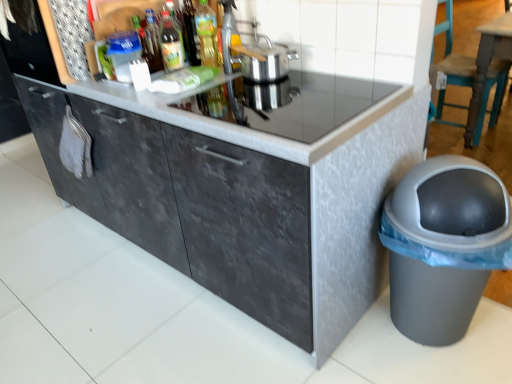
Question: Considering the relative sizes of metallic silver pot at upper center and translucent glass bottle at upper center, the first bottle in the right-to-left sequence, in the image provided, is metallic silver pot at upper center thinner than translucent glass bottle at upper center, the first bottle in the right-to-left sequence,?

Choices:
 (A) yes
 (B) no

Answer: (A)

Question: Does metallic silver pot at upper center have a smaller size compared to translucent glass bottle at upper center, the 4th bottle viewed from the left?

Choices:
 (A) no
 (B) yes

Answer: (A)

Question: Considering the relative sizes of metallic silver pot at upper center and translucent glass bottle at upper center, the first bottle in the right-to-left sequence, in the image provided, is metallic silver pot at upper center shorter than translucent glass bottle at upper center, the first bottle in the right-to-left sequence,?

Choices:
 (A) no
 (B) yes

Answer: (B)

Question: From the image's perspective, is metallic silver pot at upper center beneath translucent glass bottle at upper center, the 4th bottle viewed from the left?

Choices:
 (A) yes
 (B) no

Answer: (A)

Question: Does metallic silver pot at upper center come behind translucent glass bottle at upper center, the 4th bottle viewed from the left?

Choices:
 (A) no
 (B) yes

Answer: (A)

Question: Does metallic silver pot at upper center have a greater width compared to translucent glass bottle at upper center, the first bottle in the right-to-left sequence?

Choices:
 (A) yes
 (B) no

Answer: (B)

Question: Is gray plastic trash can at lower right smaller than silver metallic pot at upper center?

Choices:
 (A) yes
 (B) no

Answer: (B)

Question: Does gray plastic trash can at lower right turn towards silver metallic pot at upper center?

Choices:
 (A) yes
 (B) no

Answer: (B)

Question: Does gray plastic trash can at lower right lie behind silver metallic pot at upper center?

Choices:
 (A) no
 (B) yes

Answer: (A)

Question: Are gray plastic trash can at lower right and silver metallic pot at upper center beside each other?

Choices:
 (A) yes
 (B) no

Answer: (B)

Question: From the image's perspective, is gray plastic trash can at lower right over silver metallic pot at upper center?

Choices:
 (A) yes
 (B) no

Answer: (B)

Question: Does gray plastic trash can at lower right have a greater height compared to silver metallic pot at upper center?

Choices:
 (A) yes
 (B) no

Answer: (A)

Question: Are green glass bottle at center, which is counted as the 3th bottle, starting from the left, and dark gray textured cabinet at center making contact?

Choices:
 (A) yes
 (B) no

Answer: (B)